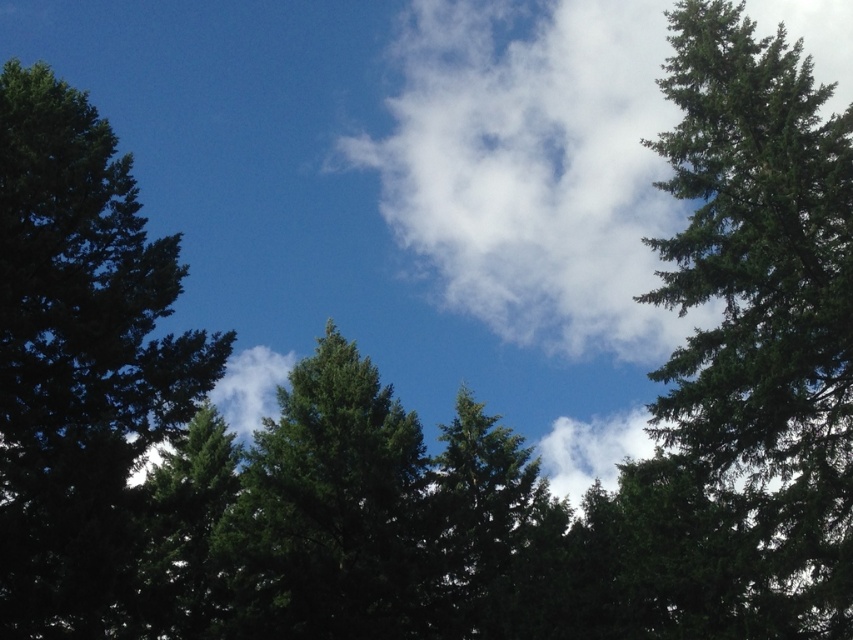
Is white fluffy cloud at center to the left of green matte tree at center from the viewer's perspective?

In fact, white fluffy cloud at center is to the right of green matte tree at center.

Is white fluffy cloud at center bigger than green matte tree at center?

Indeed, white fluffy cloud at center has a larger size compared to green matte tree at center.

I want to click on white fluffy cloud at center, so click(x=534, y=168).

Is green textured tree at right further to the viewer compared to white fluffy cloud at center?

No, it is not.

Can you confirm if green textured tree at right is smaller than white fluffy cloud at center?

No, green textured tree at right is not smaller than white fluffy cloud at center.

At what (x,y) coordinates should I click in order to perform the action: click on green textured tree at right. Please return your answer as a coordinate pair (x, y). The image size is (853, 640). Looking at the image, I should click on (762, 310).

Between green textured tree at right and dark green textured tree at left, which one is positioned lower?

dark green textured tree at left is lower down.

Between point (688, 232) and point (32, 561), which one is positioned behind?

The point (688, 232) is more distant.

Find the location of `green textured tree at right`. green textured tree at right is located at coordinates (762, 310).